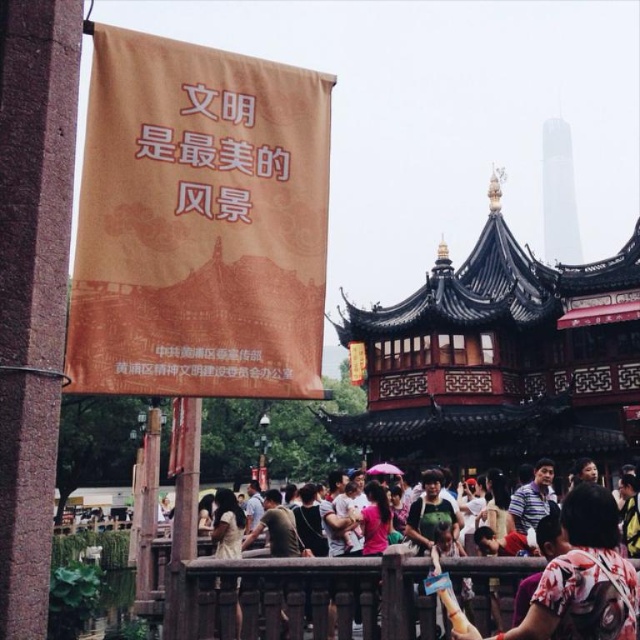
You are a photographer trying to capture both the light yellow fabric at center and the matte pink shirt at center in a single frame. Based on their widths, which object should you position closer to the camera to ensure both fit in the shot?

The light yellow fabric at center might be wider than the matte pink shirt at center, so positioning the light yellow fabric at center closer to the camera would help accommodate its potentially larger width within the frame.

You are a photographer trying to capture both the light yellow fabric at center and the matte pink shirt at center in a single frame. Based on their positions, which object should you adjust your camera angle to focus on first to ensure both are in the shot?

The light yellow fabric at center is to the left of matte pink shirt at center. To capture both in a single frame, you should adjust your camera angle to focus on the light yellow fabric at center first since it is positioned to the left, allowing you to frame the matte pink shirt at center to its right without losing either from the shot.